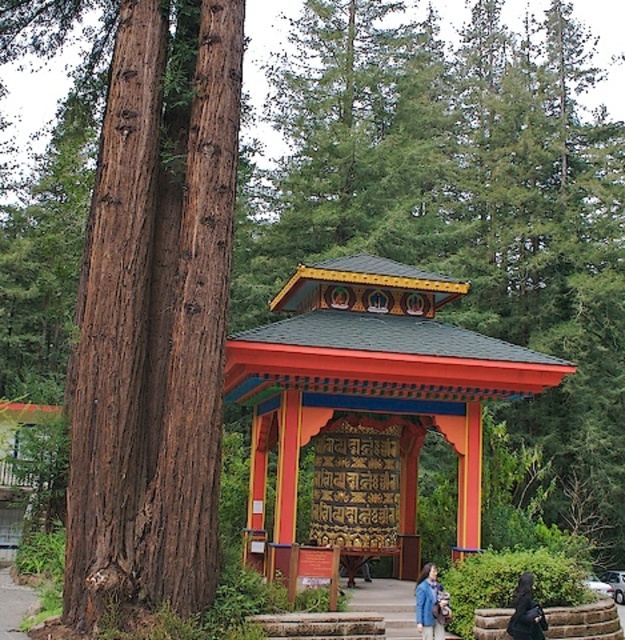
Question: Which object is the closest to the black fabric coat at lower right?

Choices:
 (A) blue denim jacket at lower right
 (B) multicolored painted pavilion at center

Answer: (A)

Question: Which object is farther from the camera taking this photo?

Choices:
 (A) black fabric coat at lower right
 (B) multicolored painted pavilion at center
 (C) blue denim jacket at lower right

Answer: (B)

Question: Is blue denim jacket at lower right thinner than black fabric coat at lower right?

Choices:
 (A) yes
 (B) no

Answer: (A)

Question: Among these points, which one is nearest to the camera?

Choices:
 (A) (512, 618)
 (B) (418, 618)
 (C) (520, 372)

Answer: (A)

Question: Can you confirm if multicolored painted pavilion at center is smaller than blue denim jacket at lower right?

Choices:
 (A) yes
 (B) no

Answer: (B)

Question: Can you confirm if multicolored painted pavilion at center is positioned to the left of blue denim jacket at lower right?

Choices:
 (A) no
 (B) yes

Answer: (B)